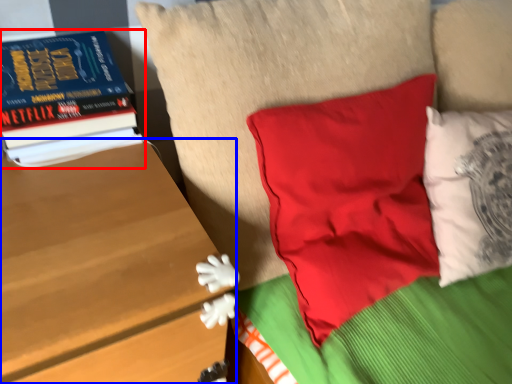
Question: Which object appears closest to the camera in this image, book (highlighted by a red box) or table (highlighted by a blue box)?

Choices:
 (A) book
 (B) table

Answer: (B)